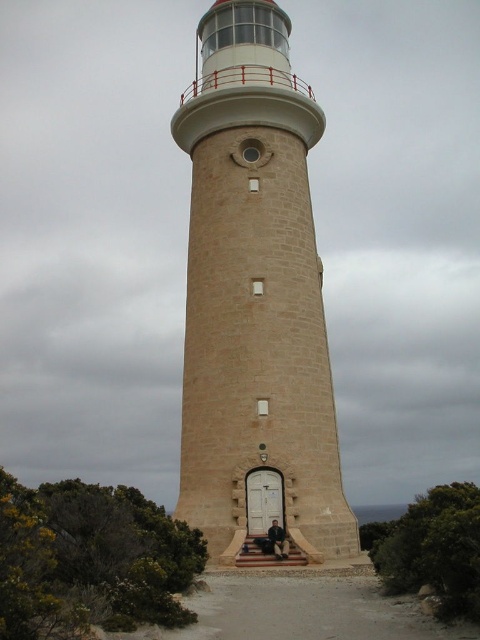
Based on the photo, how distant is beige stone lighthouse at center from wooden staircase at center?

They are 42.52 feet apart.

Who is more forward, (255,312) or (264,536)?

Point (264,536) is more forward.

Where is `beige stone lighthouse at center`? beige stone lighthouse at center is located at coordinates (254, 294).

Find the location of a particular element. beige stone lighthouse at center is located at coordinates (254, 294).

Is beige stone lighthouse at center to the left of dark brown leather chair at center from the viewer's perspective?

Correct, you'll find beige stone lighthouse at center to the left of dark brown leather chair at center.

Is the position of beige stone lighthouse at center more distant than that of dark brown leather chair at center?

No, it is in front of dark brown leather chair at center.

Between point (268, 435) and point (278, 538), which one is positioned behind?

Point (268, 435)

Where is `beige stone lighthouse at center`? This screenshot has width=480, height=640. beige stone lighthouse at center is located at coordinates (254, 294).

Is point (264, 561) in front of point (275, 518)?

Yes, it is.

Where is `wooden staircase at center`? The width and height of the screenshot is (480, 640). wooden staircase at center is located at coordinates click(x=265, y=556).